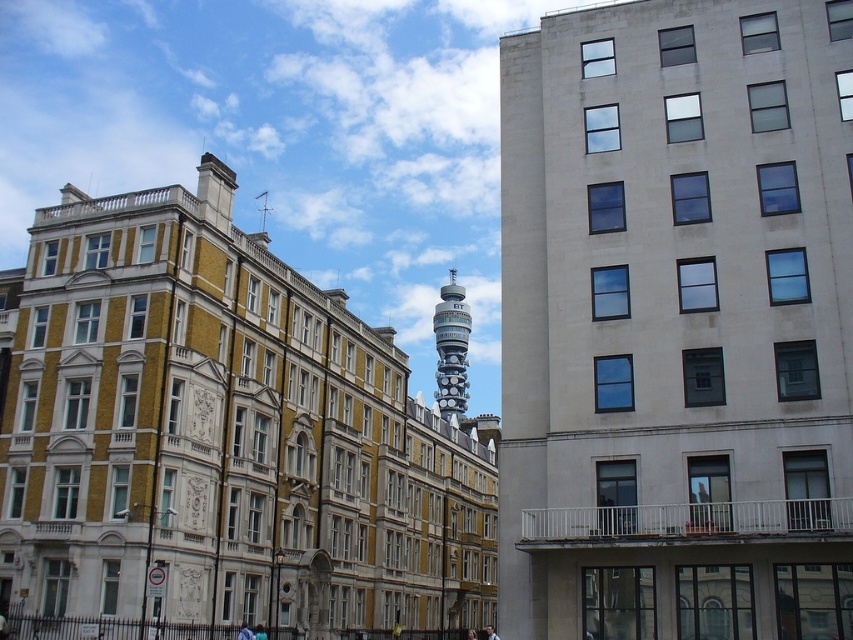
Question: Which object is the closest to the light brown hair at center?

Choices:
 (A) silver metallic bt tower at center
 (B) smooth concrete tower at center

Answer: (B)

Question: Does silver metallic bt tower at center appear under light brown hair at center?

Choices:
 (A) yes
 (B) no

Answer: (B)

Question: Observing the image, what is the correct spatial positioning of smooth concrete tower at center in reference to light brown hair at center?

Choices:
 (A) below
 (B) above

Answer: (B)

Question: Can you confirm if silver metallic bt tower at center is thinner than light brown hair at center?

Choices:
 (A) no
 (B) yes

Answer: (A)

Question: Which object is the farthest from the smooth concrete tower at center?

Choices:
 (A) silver metallic bt tower at center
 (B) light brown hair at center

Answer: (A)

Question: Which object appears closest to the camera in this image?

Choices:
 (A) light brown hair at center
 (B) smooth concrete tower at center
 (C) silver metallic bt tower at center

Answer: (B)